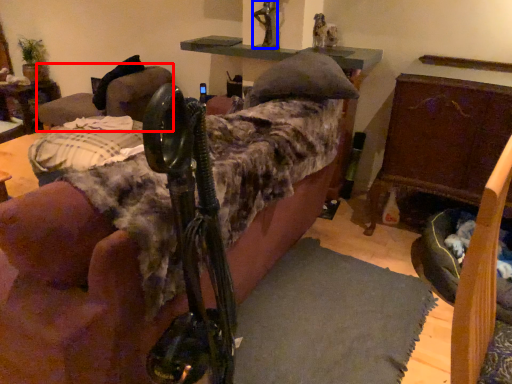
Question: Among these objects, which one is farthest to the camera, swivel chair (highlighted by a red box) or person (highlighted by a blue box)?

Choices:
 (A) swivel chair
 (B) person

Answer: (A)